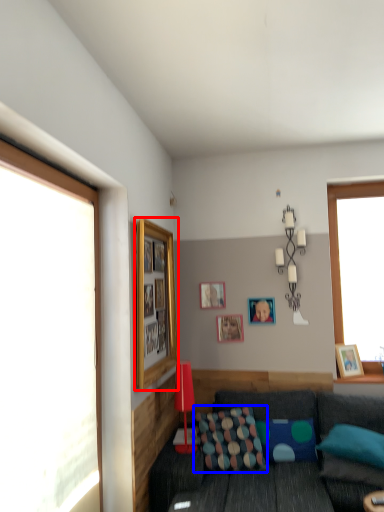
Question: Which object appears closest to the camera in this image, picture frame (highlighted by a red box) or pillow (highlighted by a blue box)?

Choices:
 (A) picture frame
 (B) pillow

Answer: (A)